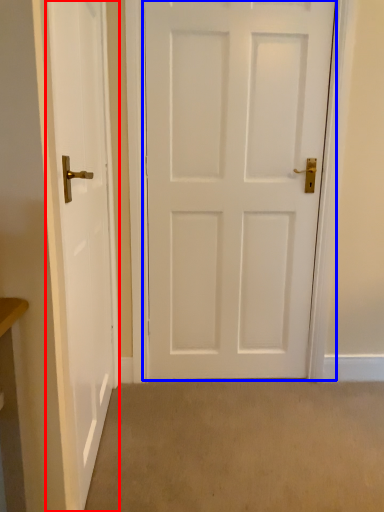
Question: Which of the following is the closest to the observer, door (highlighted by a red box) or door (highlighted by a blue box)?

Choices:
 (A) door
 (B) door

Answer: (A)